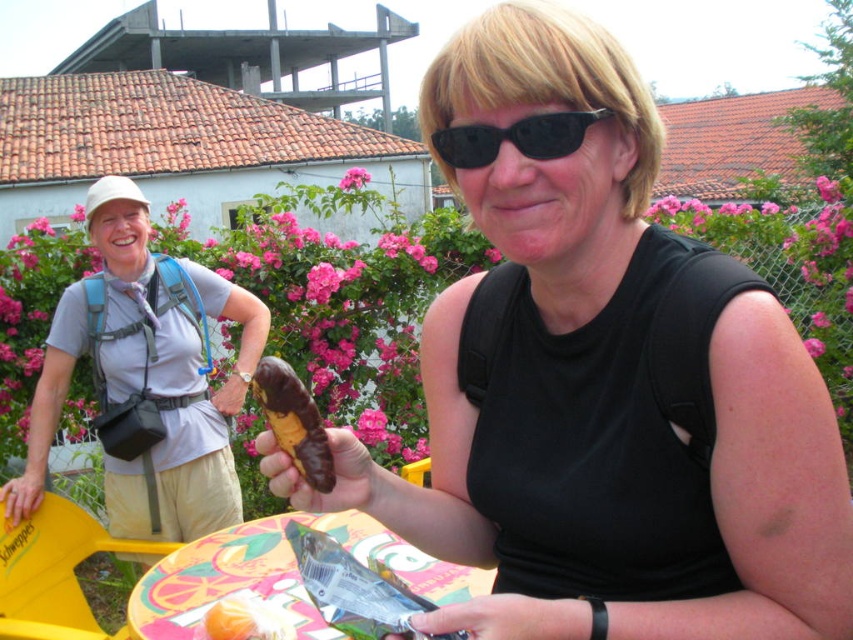
You are planning to take a photo of the matte chocolate banana at center and the gray fabric backpack at left. Which object should you focus on first if you want to capture both in the same frame without moving the camera?

You should focus on the matte chocolate banana at center first because it is located above the gray fabric backpack at left, so adjusting the camera angle to include both would require framing from the top down.

You are a photographer trying to capture the matte chocolate banana at center in your shot. The camera you are using has a rectangular viewfinder with a 4x3 aspect ratio. The coordinates of the viewfinder corners are at points A1, A2, A3, A4. The coordinates of the banana are at point B. You want to know if the banana is within the viewfinder. What is the answer?

The coordinates of the matte chocolate banana at center are at point B, which is at point B. The viewfinder corners are at points A1, A2, A3, A4. Without knowing the exact coordinates of the viewfinder corners, it is impossible to determine if the banana is within the viewfinder.

You are a photographer standing at the painted wood table at center. You want to take a photo of both people in the scene. Can you fit both of them in your frame if your camera has a 6 feet wide field of view?

The two individuals are 4.70 feet apart. Since the camera has a 6 feet wide field of view, which is wider than the distance between them, you can fit both of them in your frame.